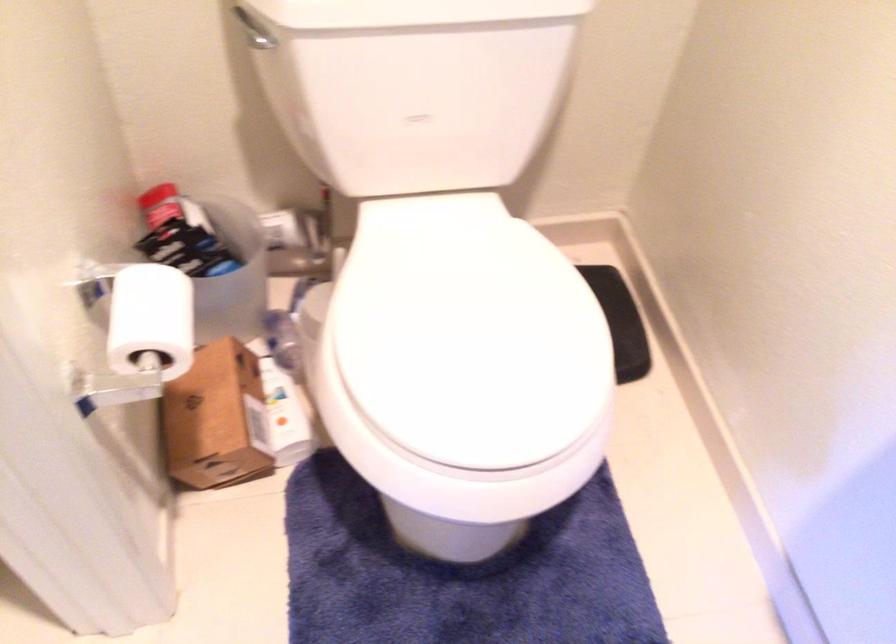
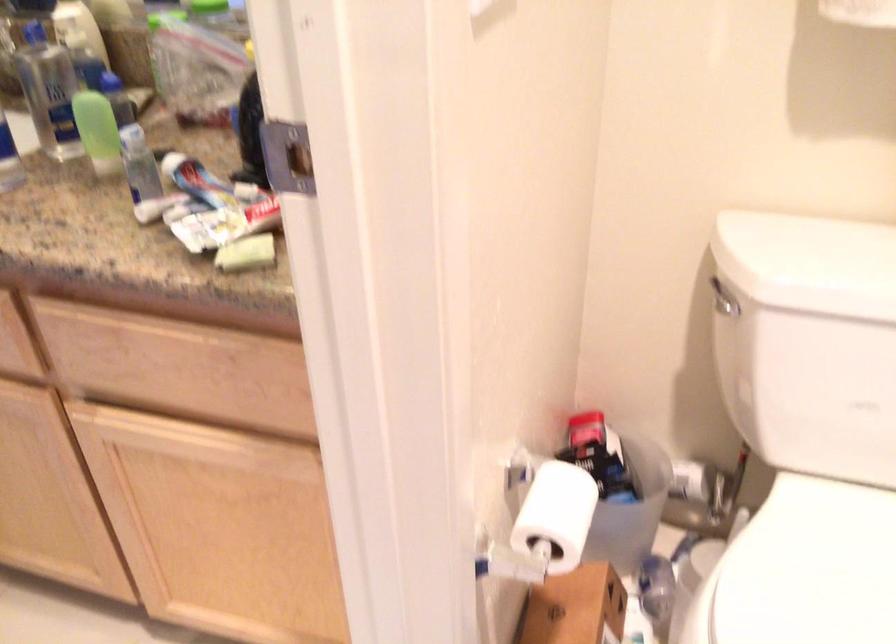
Question: The first image is from the beginning of the video and the second image is from the end. How did the camera likely rotate when shooting the video?

Choices:
 (A) Left
 (B) Right
 (C) Up
 (D) Down

Answer: (A)